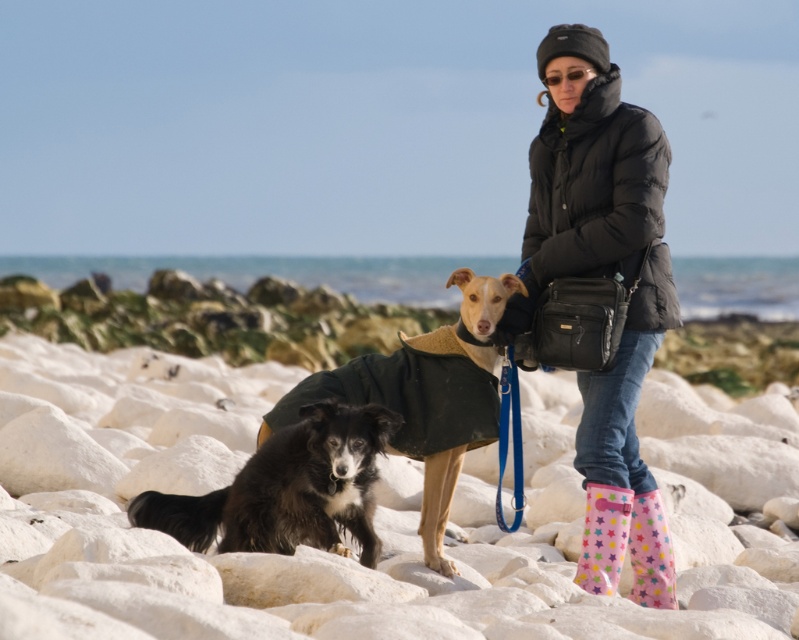
Is white smooth rocks at center below shaggy black fur at center?

No.

Between white smooth rocks at center and shaggy black fur at center, which one is positioned higher?

white smooth rocks at center

Who is more forward, (x=125, y=592) or (x=146, y=515)?

Positioned in front is point (x=125, y=592).

The height and width of the screenshot is (640, 799). Find the location of `white smooth rocks at center`. white smooth rocks at center is located at coordinates (372, 516).

Is black puffy coat at upper right to the right of black fur coat at center from the viewer's perspective?

Yes, black puffy coat at upper right is to the right of black fur coat at center.

Which is in front, point (543, 218) or point (404, 419)?

Point (404, 419) is in front.

Where is `black puffy coat at upper right`? The width and height of the screenshot is (799, 640). black puffy coat at upper right is located at coordinates (601, 198).

Find the location of `black puffy coat at upper right`. black puffy coat at upper right is located at coordinates (601, 198).

From the picture: Does shaggy black fur at center have a smaller size compared to pastel star-patterned rubber boot at lower right?

No.

Between point (203, 528) and point (670, 605), which one is positioned in front?

Point (203, 528)

The height and width of the screenshot is (640, 799). I want to click on shaggy black fur at center, so click(x=288, y=488).